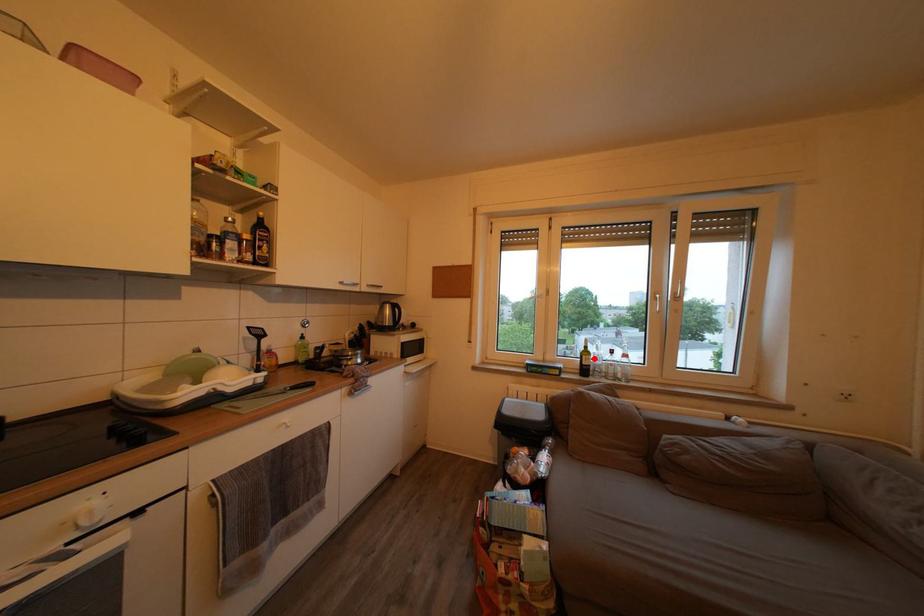
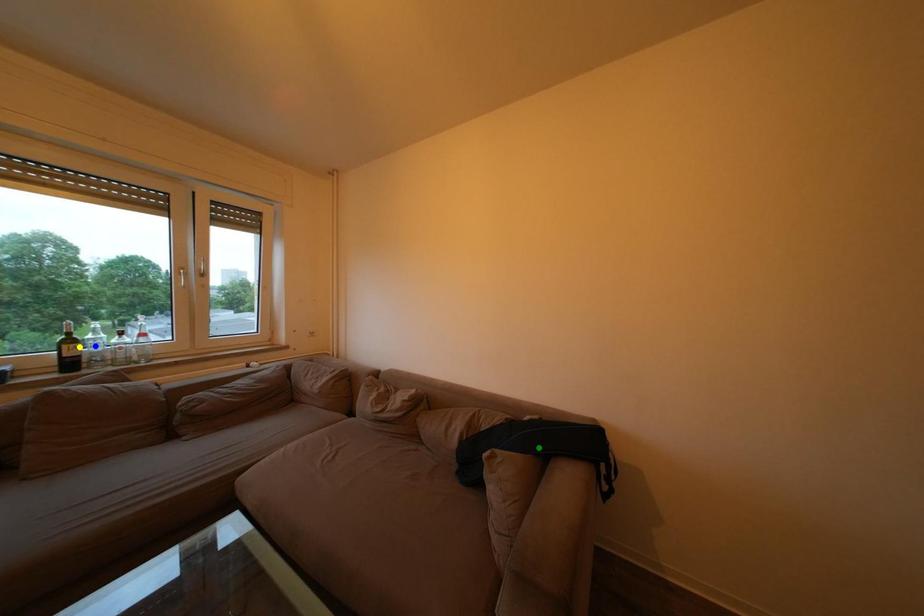
Question: I am providing you with two images of the same scene from different viewpoints. A red point is marked on the first image. You are given multiple points on the second image. Which point in image 2 is actually the same real-world point as the red point in image 1?

Choices:
 (A) green point
 (B) blue point
 (C) yellow point

Answer: (C)